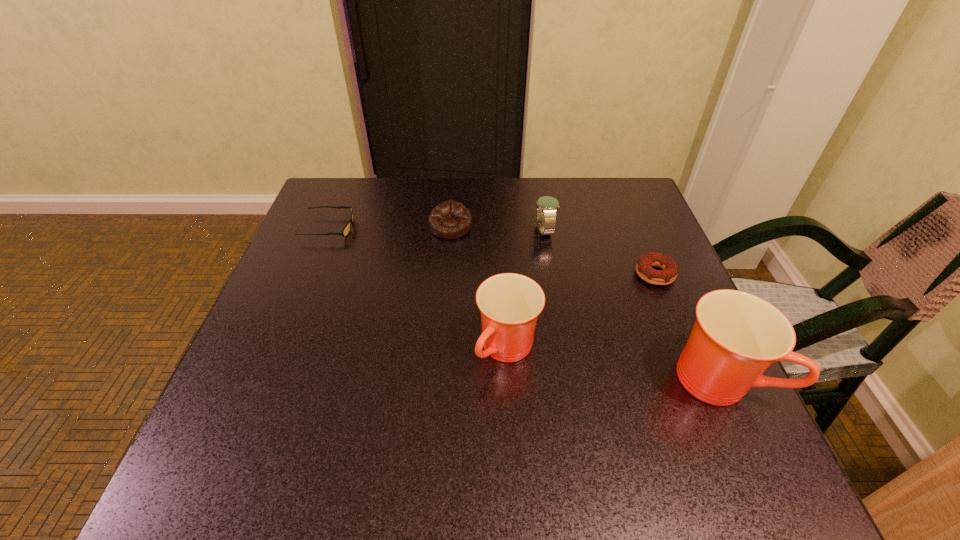
The cups are evenly distributed in the image. To maintain this, where would you place another cup on the left? Please point to a free space. Please provide its 2D coordinates. Your answer should be formatted as a tuple, i.e. [(x, y)], where the tuple contains the x and y coordinates of a point satisfying the conditions above.

[(318, 322)]